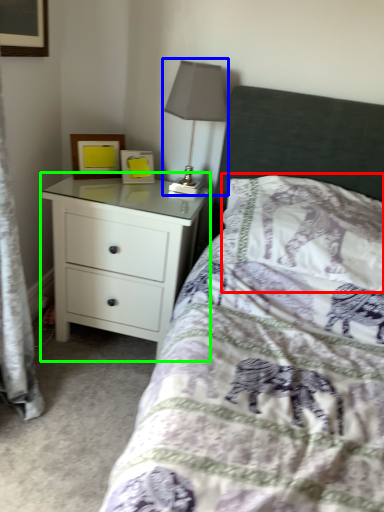
Question: Which object is positioned closest to pillow (highlighted by a red box)? Select from table lamp (highlighted by a blue box) and chest of drawers (highlighted by a green box).

Choices:
 (A) table lamp
 (B) chest of drawers

Answer: (A)